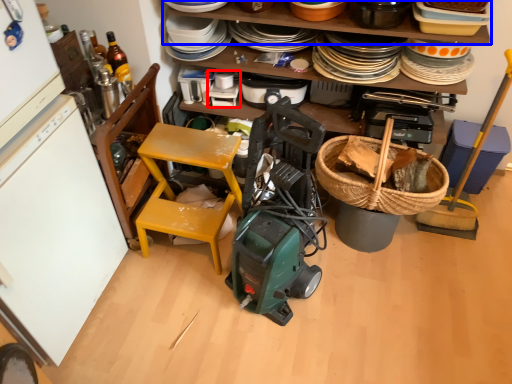
Question: Among these objects, which one is nearest to the camera, appliance (highlighted by a red box) or shelf (highlighted by a blue box)?

Choices:
 (A) appliance
 (B) shelf

Answer: (B)